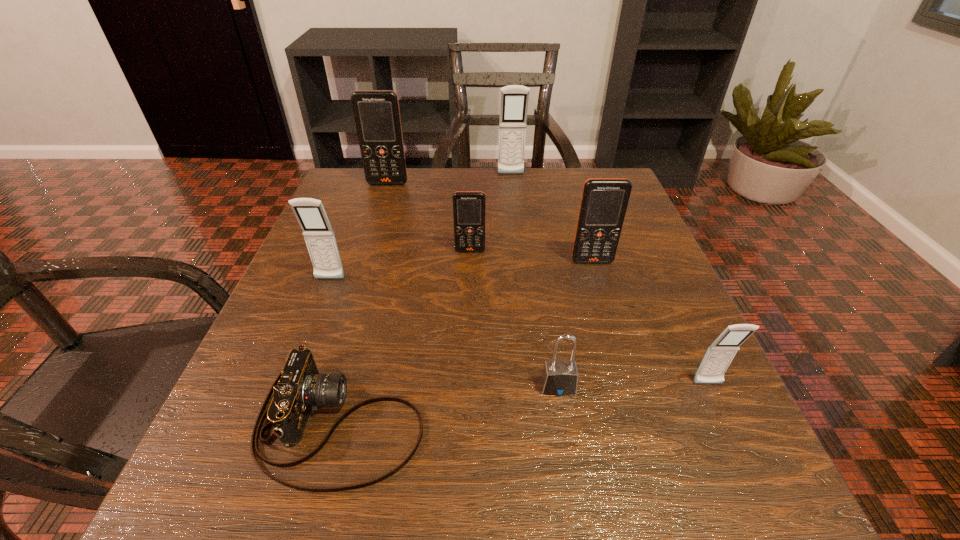
Select which gray cellular telephone appears as the second closest to the second farthest gray cellular telephone. Please provide its 2D coordinates. Your answer should be formatted as a tuple, i.e. [(x, y)], where the tuple contains the x and y coordinates of a point satisfying the conditions above.

[(721, 352)]

Locate an element on the screen. This screenshot has width=960, height=540. the closest gray cellular telephone to the leftmost gray cellular telephone is located at coordinates (514, 99).

This screenshot has width=960, height=540. Identify the location of orange cellular telephone that is the third nearest to the farthest gray cellular telephone. (604, 201).

Identify the location of orange cellular telephone that is the third closest to the farthest gray cellular telephone. (604, 201).